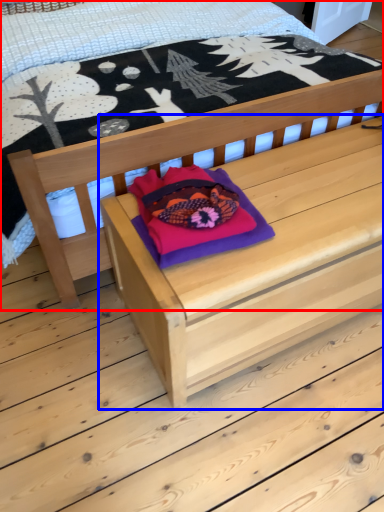
Question: Among these objects, which one is nearest to the camera, bed (highlighted by a red box) or table (highlighted by a blue box)?

Choices:
 (A) bed
 (B) table

Answer: (A)